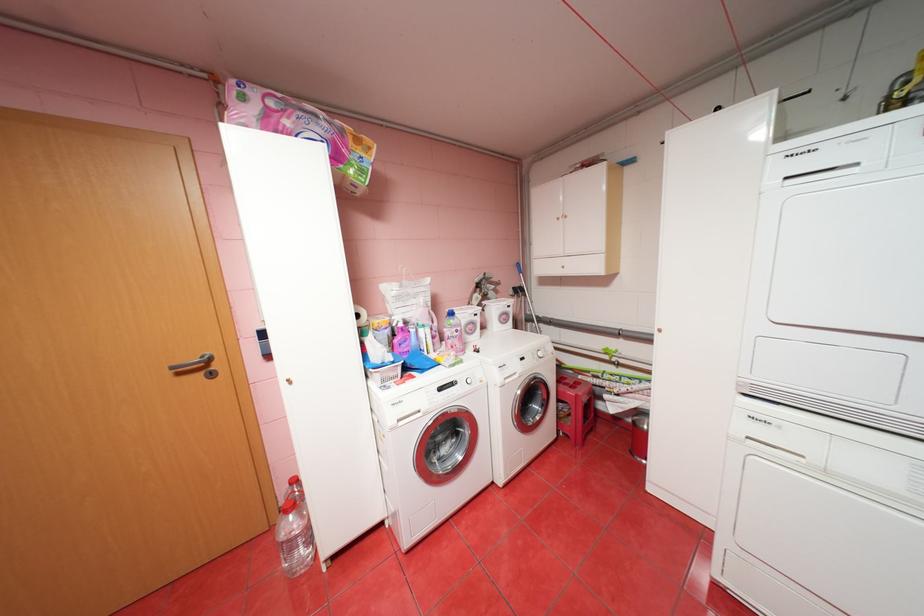
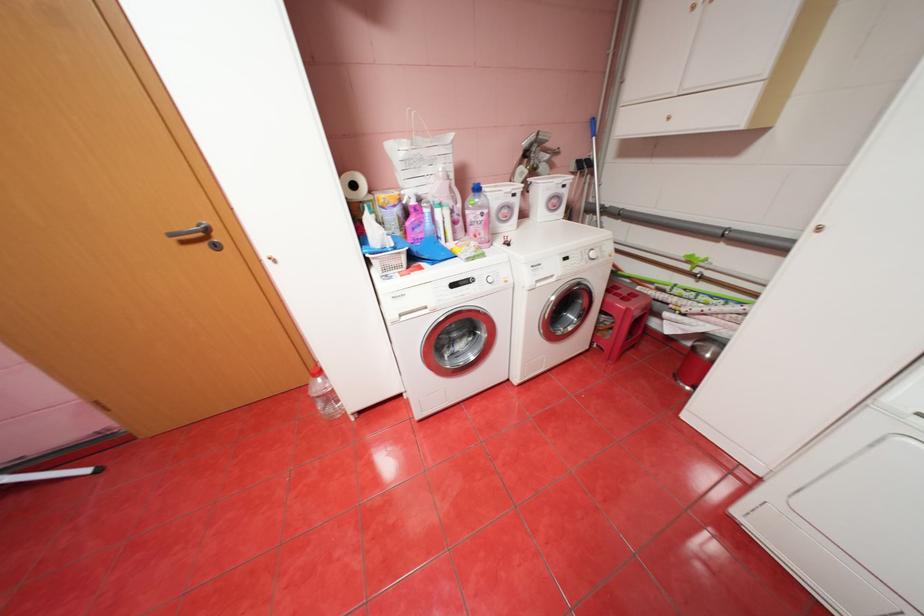
Locate, in the second image, the point that corresponds to (x=209, y=374) in the first image.

(213, 245)